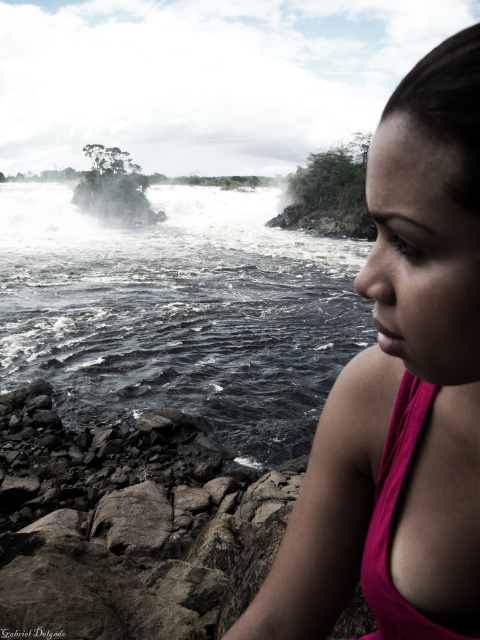
Question: Does pink fabric at center have a larger size compared to dark gray rocky river at lower left?

Choices:
 (A) no
 (B) yes

Answer: (A)

Question: Can you confirm if pink fabric at center is thinner than dark gray rocky river at lower left?

Choices:
 (A) no
 (B) yes

Answer: (B)

Question: Which point is farther to the camera?

Choices:
 (A) (279, 326)
 (B) (359, 364)

Answer: (A)

Question: In this image, where is pink fabric at center located relative to dark gray rocky river at lower left?

Choices:
 (A) left
 (B) right

Answer: (B)